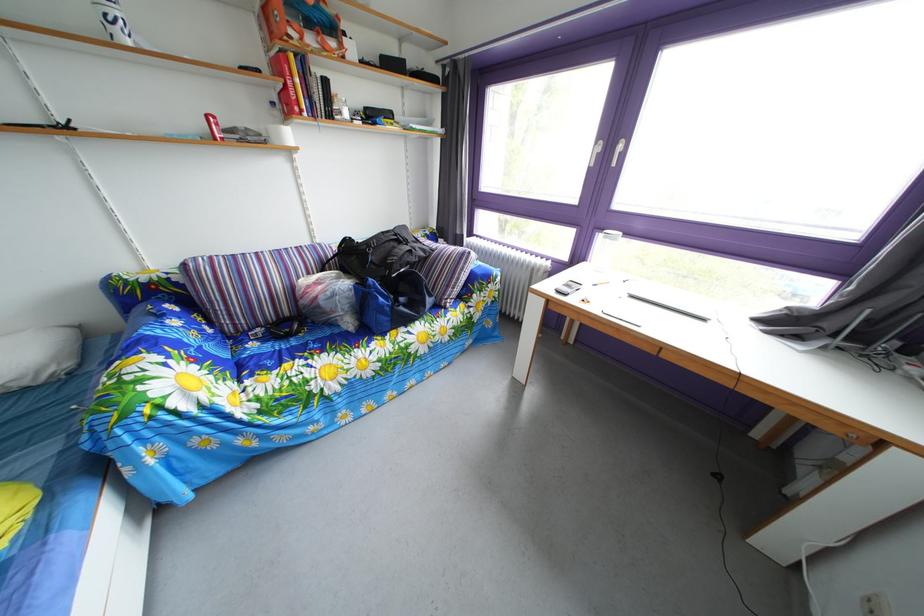
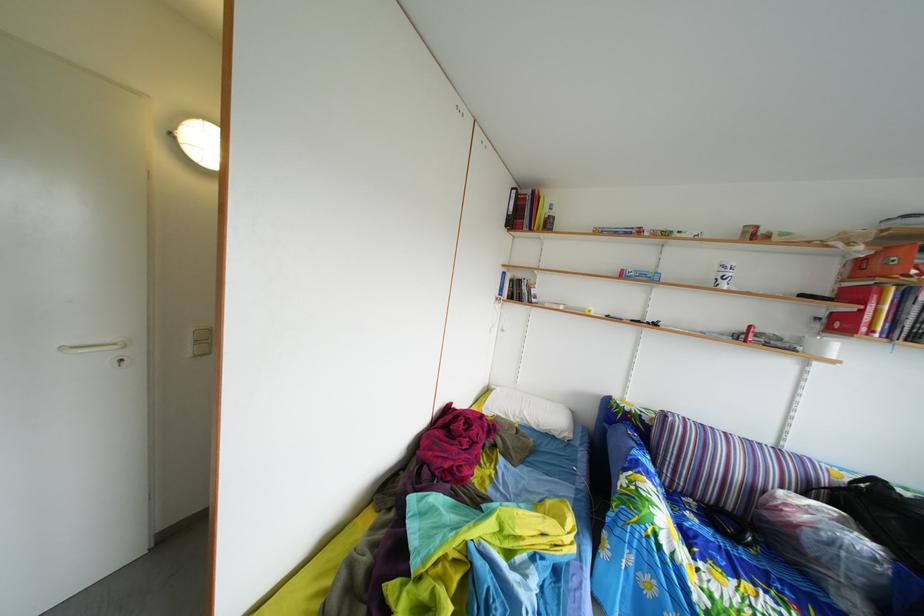
Locate, in the second image, the point that corresponds to point (360, 265) in the first image.

(886, 515)